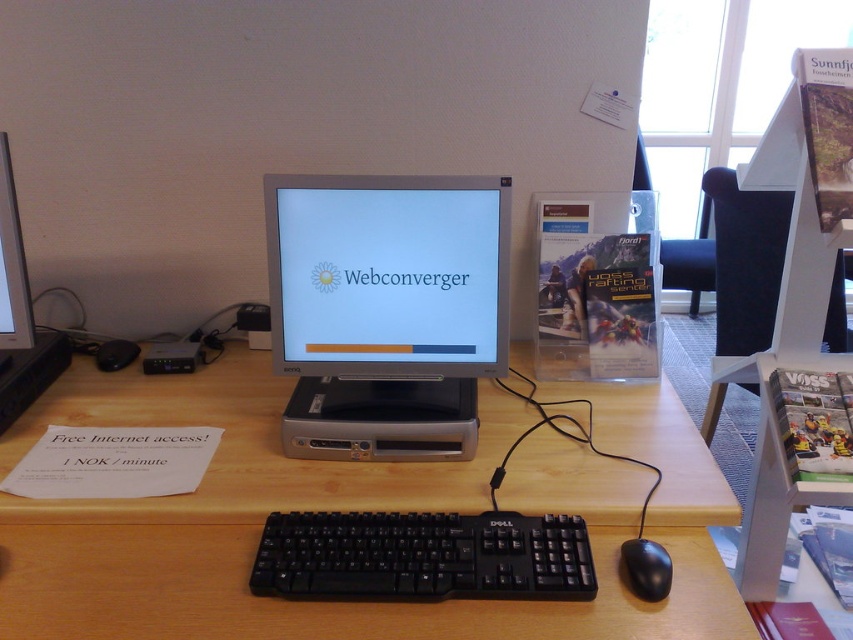
Question: Does satin silver monitor at center appear on the left side of satin silver monitor at left?

Choices:
 (A) no
 (B) yes

Answer: (A)

Question: Among these points, which one is farthest from the camera?

Choices:
 (A) (271, 547)
 (B) (653, 572)

Answer: (A)

Question: Which point is closer to the camera taking this photo?

Choices:
 (A) (1, 148)
 (B) (639, 579)
 (C) (30, 401)
 (D) (432, 330)

Answer: (B)

Question: Which of the following is the closest to the observer?

Choices:
 (A) (12, 320)
 (B) (274, 572)
 (C) (664, 566)
 (D) (486, 268)

Answer: (B)

Question: Can you confirm if satin silver monitor at center is wider than satin silver monitor at left?

Choices:
 (A) no
 (B) yes

Answer: (B)

Question: Observing the image, what is the correct spatial positioning of matte silver monitor at center in reference to black matte mouse at lower right?

Choices:
 (A) right
 (B) left

Answer: (B)